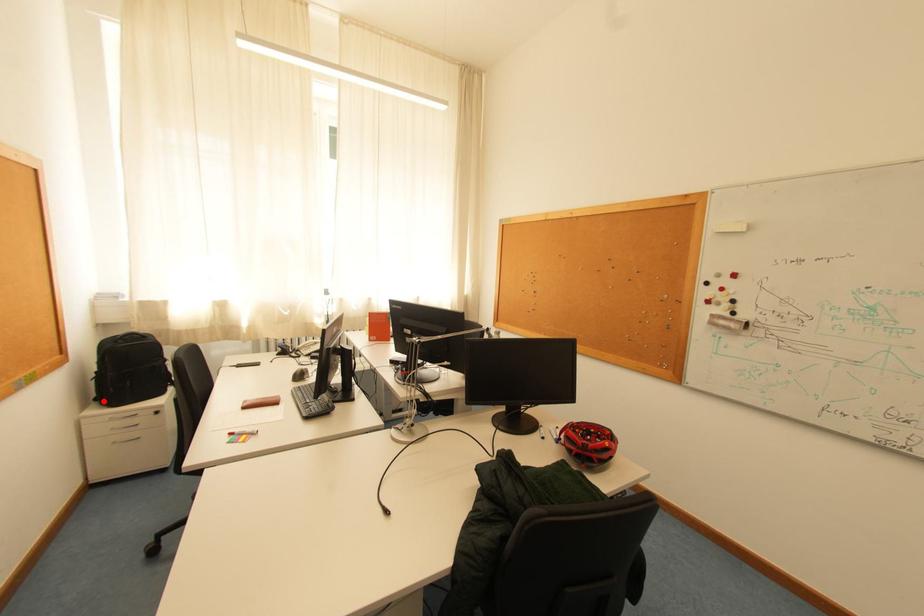
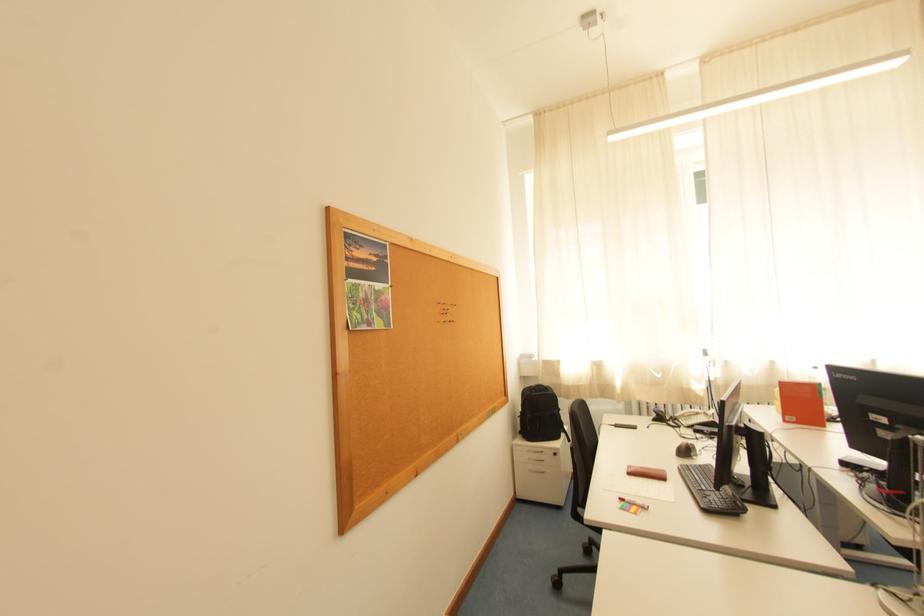
Question: I am providing you with two images of the same scene from different viewpoints. Given a red point in image1, look at the same physical point in image2. Is it:

Choices:
 (A) Closer to the viewpoint
 (B) Farther from the viewpoint

Answer: (B)